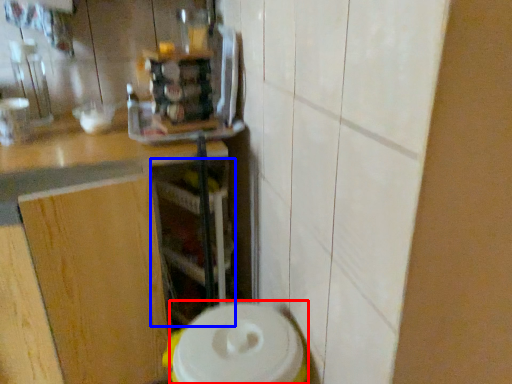
Question: Which point is further to the camera, appliance (highlighted by a red box) or shelf (highlighted by a blue box)?

Choices:
 (A) appliance
 (B) shelf

Answer: (B)